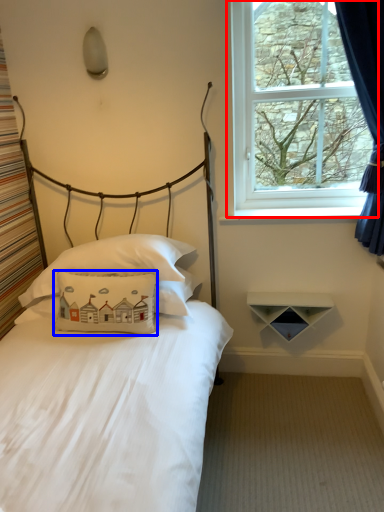
Question: Which object is closer to the camera taking this photo, window (highlighted by a red box) or pillow (highlighted by a blue box)?

Choices:
 (A) window
 (B) pillow

Answer: (B)